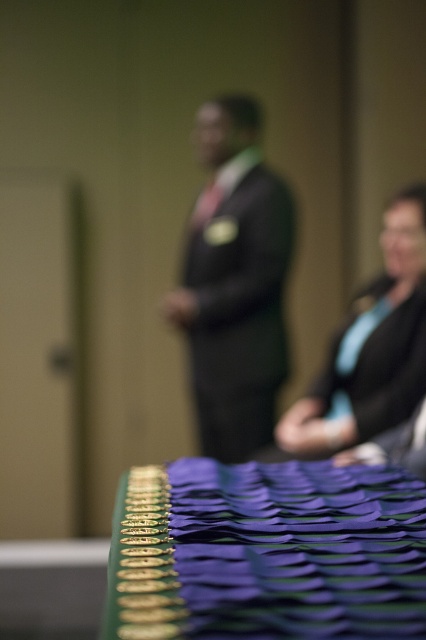
Does green fabric table at lower center appear on the right side of matte black sweater at right?

In fact, green fabric table at lower center is to the left of matte black sweater at right.

Is point (238, 637) closer to viewer compared to point (336, 403)?

Yes, point (238, 637) is in front of point (336, 403).

Measure the distance between point (339, 561) and camera.

Point (339, 561) and camera are 49.92 centimeters apart from each other.

Where is `green fabric table at lower center`? The width and height of the screenshot is (426, 640). green fabric table at lower center is located at coordinates (267, 554).

Is dark suit at center further to the viewer compared to matte black sweater at right?

Yes, dark suit at center is further from the viewer.

Is point (209, 268) closer to viewer compared to point (336, 429)?

No.

Does point (245, 186) lie behind point (354, 420)?

Yes, point (245, 186) is farther from viewer.

Image resolution: width=426 pixels, height=640 pixels. Find the location of `dark suit at center`. dark suit at center is located at coordinates (235, 282).

Is green fabric table at lower center below dark suit at center?

Indeed, green fabric table at lower center is positioned under dark suit at center.

Does green fabric table at lower center have a greater width compared to dark suit at center?

In fact, green fabric table at lower center might be narrower than dark suit at center.

Which is behind, point (298, 476) or point (215, 172)?

Positioned behind is point (215, 172).

The height and width of the screenshot is (640, 426). What are the coordinates of `green fabric table at lower center` in the screenshot? It's located at (267, 554).